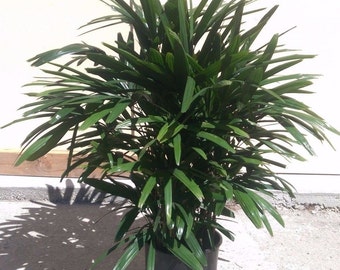
This screenshot has width=340, height=270. Find the location of `plant`. plant is located at coordinates (184, 121).